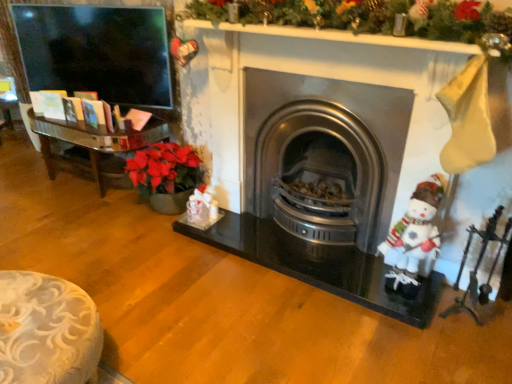
What is the approximate width of white fabric santa claus at right?

The width of white fabric santa claus at right is 9.93 inches.

Where is `stainless steel wood burning stove at center`? The width and height of the screenshot is (512, 384). stainless steel wood burning stove at center is located at coordinates (324, 154).

Image resolution: width=512 pixels, height=384 pixels. Find the location of `metallic silver fireplace tools at right`. metallic silver fireplace tools at right is located at coordinates (478, 266).

Where is `santa claus lying on the left of metallic silver fireplace tools at right`? This screenshot has height=384, width=512. santa claus lying on the left of metallic silver fireplace tools at right is located at coordinates (415, 231).

From the image's perspective, would you say metallic silver fireplace tools at right is positioned over white fabric santa claus at right?

No, from the image's perspective, metallic silver fireplace tools at right is not above white fabric santa claus at right.

In terms of size, does metallic silver fireplace tools at right appear bigger or smaller than white fabric santa claus at right?

In the image, metallic silver fireplace tools at right appears to be smaller than white fabric santa claus at right.

Which object is positioned more to the left, metallic silver fireplace tools at right or white fabric santa claus at right?

white fabric santa claus at right.

Would you say white fabric santa claus at right contains metallic silver fireplace tools at right?

No.

Does white fabric santa claus at right have a lesser height compared to metallic silver fireplace tools at right?

Yes.

Are white fabric santa claus at right and metallic silver fireplace tools at right far apart?

No, white fabric santa claus at right is not far from metallic silver fireplace tools at right.

Could stainless steel wood burning stove at center be considered to be inside white fabric santa claus at right?

No.

Considering the sizes of objects white fabric santa claus at right and stainless steel wood burning stove at center in the image provided, who is smaller, white fabric santa claus at right or stainless steel wood burning stove at center?

white fabric santa claus at right is smaller.

In the image, is white fabric santa claus at right positioned in front of or behind stainless steel wood burning stove at center?

Visually, white fabric santa claus at right is located in front of stainless steel wood burning stove at center.

Measure the distance between white fabric santa claus at right and stainless steel wood burning stove at center.

white fabric santa claus at right and stainless steel wood burning stove at center are 17.63 inches apart.

Could you measure the distance between stainless steel wood burning stove at center and white fabric santa claus at right?

stainless steel wood burning stove at center is 17.63 inches away from white fabric santa claus at right.

Considering the positions of objects stainless steel wood burning stove at center and white fabric santa claus at right in the image provided, who is more to the left, stainless steel wood burning stove at center or white fabric santa claus at right?

stainless steel wood burning stove at center is more to the left.

Can we say stainless steel wood burning stove at center lies outside white fabric santa claus at right?

Yes, stainless steel wood burning stove at center is outside of white fabric santa claus at right.

Is stainless steel wood burning stove at center beside white fabric santa claus at right?

No, stainless steel wood burning stove at center is not making contact with white fabric santa claus at right.

Can you confirm if metallic silver fireplace tools at right is positioned to the right of stainless steel wood burning stove at center?

Correct, you'll find metallic silver fireplace tools at right to the right of stainless steel wood burning stove at center.

Considering the positions of objects metallic silver fireplace tools at right and stainless steel wood burning stove at center in the image provided, who is in front, metallic silver fireplace tools at right or stainless steel wood burning stove at center?

metallic silver fireplace tools at right is in front.

Which is nearer, (470, 311) or (272, 89)?

Point (470, 311) appears to be closer to the viewer than point (272, 89).

Considering the relative sizes of metallic silver fireplace tools at right and stainless steel wood burning stove at center in the image provided, is metallic silver fireplace tools at right smaller than stainless steel wood burning stove at center?

Yes.

Consider the image. Is stainless steel wood burning stove at center oriented away from metallic silver fireplace tools at right?

No, stainless steel wood burning stove at center is not facing away from metallic silver fireplace tools at right.

Is point (380, 136) more distant than point (495, 213)?

Yes, it is behind point (495, 213).

Considering the sizes of objects stainless steel wood burning stove at center and metallic silver fireplace tools at right in the image provided, who is bigger, stainless steel wood burning stove at center or metallic silver fireplace tools at right?

stainless steel wood burning stove at center.

Image resolution: width=512 pixels, height=384 pixels. Find the location of `santa claus that appears behind the metallic silver fireplace tools at right`. santa claus that appears behind the metallic silver fireplace tools at right is located at coordinates (415, 231).

You are a GUI agent. You are given a task and a screenshot of the screen. Output one action in this format:
    pyautogui.click(x=<x>, y=<y>)
    Task: Click on the toy in front of the white fabric santa claus at right
    The width and height of the screenshot is (512, 384).
    Given the screenshot: What is the action you would take?
    pyautogui.click(x=478, y=266)

When comparing their distances from stainless steel wood burning stove at center, does metallic silver fireplace tools at right or white fabric santa claus at right seem further?

Among the two, metallic silver fireplace tools at right is located further to stainless steel wood burning stove at center.

Which object lies further to the anchor point metallic silver fireplace tools at right, white fabric santa claus at right or stainless steel wood burning stove at center?

The object further to metallic silver fireplace tools at right is stainless steel wood burning stove at center.

Estimate the real-world distances between objects in this image. Which object is further from stainless steel wood burning stove at center, white fabric santa claus at right or metallic silver fireplace tools at right?

metallic silver fireplace tools at right.

When comparing their distances from white fabric santa claus at right, does stainless steel wood burning stove at center or metallic silver fireplace tools at right seem further?

stainless steel wood burning stove at center lies further to white fabric santa claus at right than the other object.

When comparing their distances from metallic silver fireplace tools at right, does stainless steel wood burning stove at center or white fabric santa claus at right seem closer?

white fabric santa claus at right.

Based on their spatial positions, is metallic silver fireplace tools at right or stainless steel wood burning stove at center further from white fabric santa claus at right?

stainless steel wood burning stove at center.

Identify the location of santa claus situated between stainless steel wood burning stove at center and metallic silver fireplace tools at right from left to right. (415, 231).